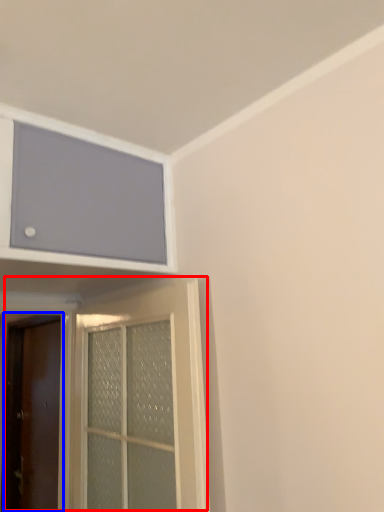
Question: Which object is further to the camera taking this photo, door (highlighted by a red box) or door (highlighted by a blue box)?

Choices:
 (A) door
 (B) door

Answer: (B)